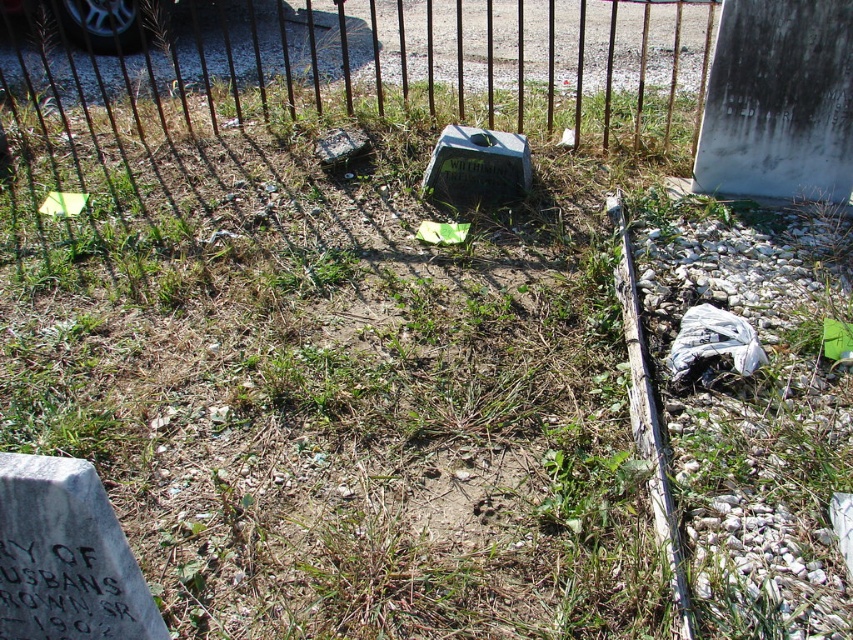
Question: Considering the real-world distances, which object is closest to the white plastic bag at lower right?

Choices:
 (A) green plastic gravestone at center
 (B) rusty metal gravestone at center
 (C) rusty metal fence at upper center

Answer: (A)

Question: Is rusty metal fence at upper center to the left of white plastic bag at lower right from the viewer's perspective?

Choices:
 (A) yes
 (B) no

Answer: (A)

Question: Which object is closer to the camera taking this photo?

Choices:
 (A) rusty metal fence at upper center
 (B) green plastic gravestone at center
 (C) white plastic bag at lower right
 (D) rusty metal gravestone at center

Answer: (C)

Question: Which object is the farthest from the rusty metal gravestone at center?

Choices:
 (A) rusty metal fence at upper center
 (B) white plastic bag at lower right

Answer: (B)

Question: Does rusty metal fence at upper center appear over white plastic bag at lower right?

Choices:
 (A) no
 (B) yes

Answer: (B)

Question: Does green plastic gravestone at center appear over white plastic bag at lower right?

Choices:
 (A) yes
 (B) no

Answer: (A)